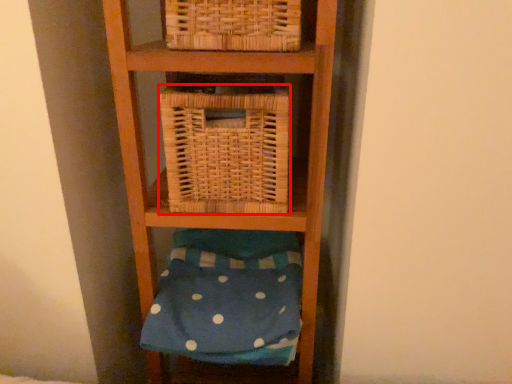
Question: From the image's perspective, where is basket (annotated by the red box) located relative to pillow?

Choices:
 (A) below
 (B) above

Answer: (B)